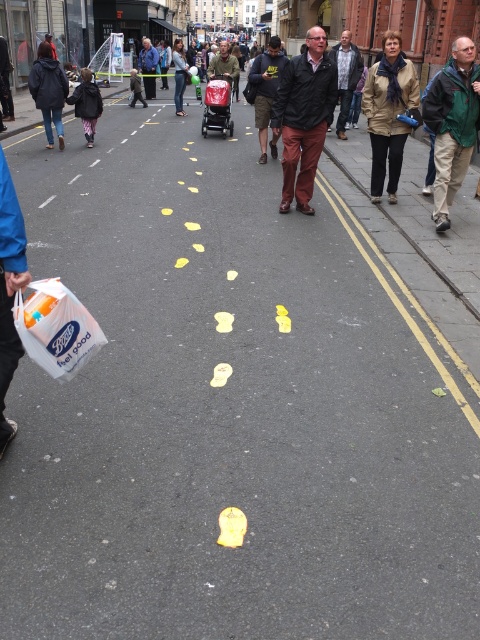
Question: Among these points, which one is farthest from the camera?

Choices:
 (A) (456, 97)
 (B) (351, 64)
 (C) (236, 58)
 (D) (86, 326)

Answer: (C)

Question: Among these points, which one is farthest from the camera?

Choices:
 (A) pos(144,86)
 (B) pos(216,58)
 (C) pos(265,74)
 (D) pos(79,305)

Answer: (A)

Question: Observing the image, what is the correct spatial positioning of green jacket at right in reference to white plastic bag at left?

Choices:
 (A) above
 (B) below

Answer: (A)

Question: Observing the image, what is the correct spatial positioning of white plastic bag at left in reference to matte green jacket at center?

Choices:
 (A) right
 (B) left

Answer: (B)

Question: Which object appears farthest from the camera in this image?

Choices:
 (A) matte green jacket at center
 (B) dark blue jacket at center
 (C) dark green jacket at center
 (D) dark brown leather jacket at center

Answer: (B)

Question: Is light brown leather jacket at center above dark blue jacket at center?

Choices:
 (A) no
 (B) yes

Answer: (A)